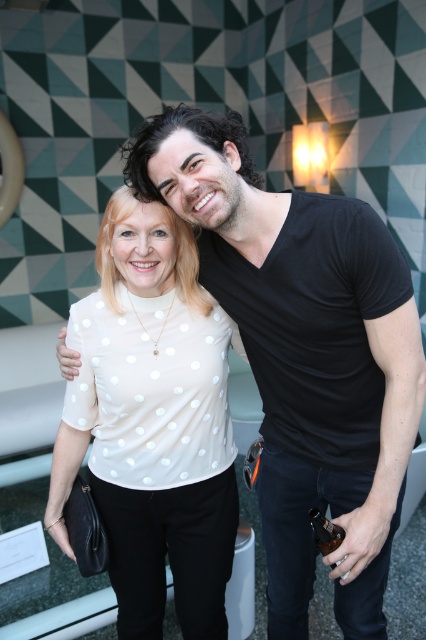
Is white dotted shirt at center bigger than white dotted blouse at center?

Yes, white dotted shirt at center is bigger than white dotted blouse at center.

Is point (273, 250) farther from camera compared to point (209, 563)?

No, (273, 250) is in front of (209, 563).

Who is more distant from viewer, (276, 369) or (152, 467)?

Point (152, 467)

Where is `white dotted shirt at center`? The width and height of the screenshot is (426, 640). white dotted shirt at center is located at coordinates (304, 355).